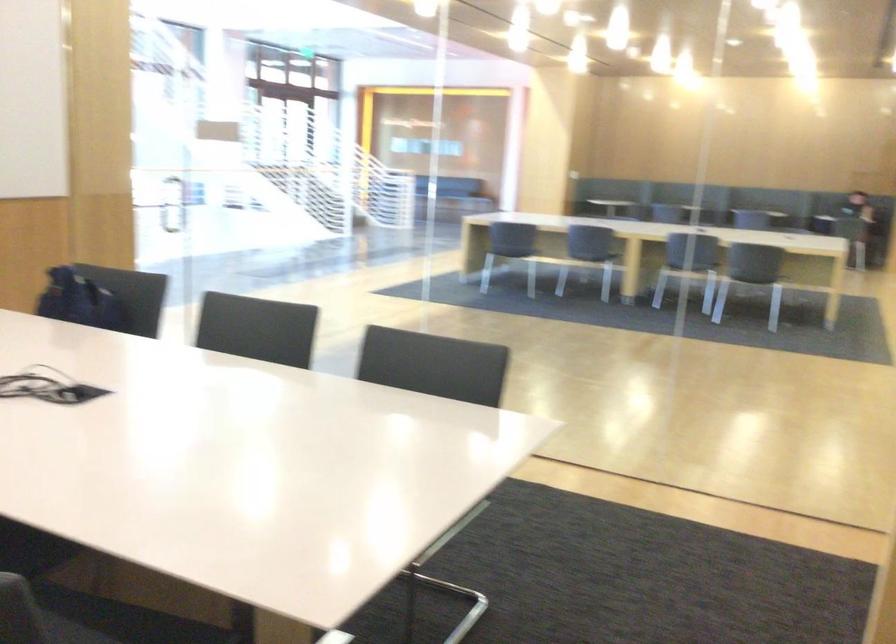
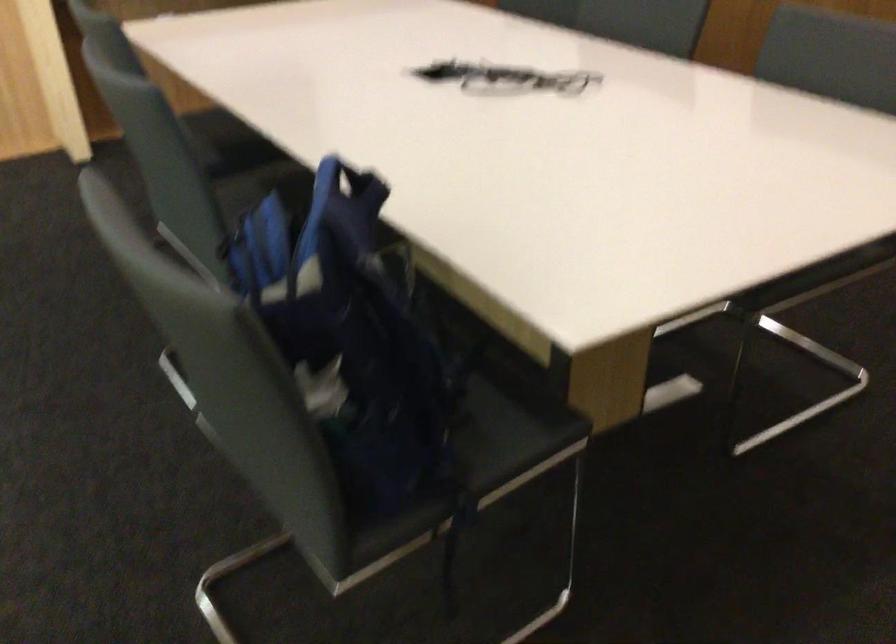
Question: I am providing you with two images of the same scene from different viewpoints. After the viewpoint changes to image2, which objects are now occluded?

Choices:
 (A) blue backpack handle
 (B) chair sitting surface
 (C) urinal flush handle
 (D) grey chair sitting surface

Answer: (D)